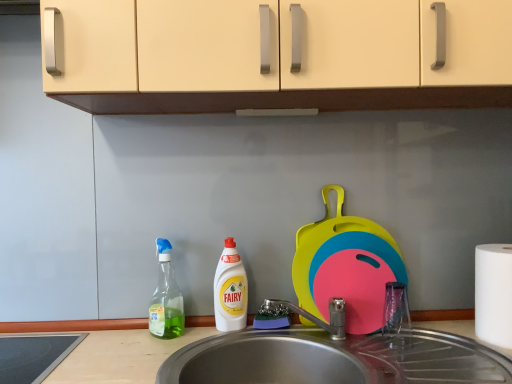
Question: From a real-world perspective, is transparent plastic spray bottle at left physically located above or below white matte paper towel at right?

Choices:
 (A) above
 (B) below

Answer: (A)

Question: From their relative heights in the image, would you say transparent plastic spray bottle at left is taller or shorter than white matte paper towel at right?

Choices:
 (A) short
 (B) tall

Answer: (B)

Question: Which object is positioned closest to the white matte paper towel at right?

Choices:
 (A) transparent plastic spray bottle at left
 (B) metallic stainless steel sink at lower center
 (C) white plastic bottle at center

Answer: (C)

Question: Which of these objects is positioned farthest from the metallic stainless steel sink at lower center?

Choices:
 (A) white plastic bottle at center
 (B) transparent plastic spray bottle at left
 (C) white matte paper towel at right

Answer: (C)